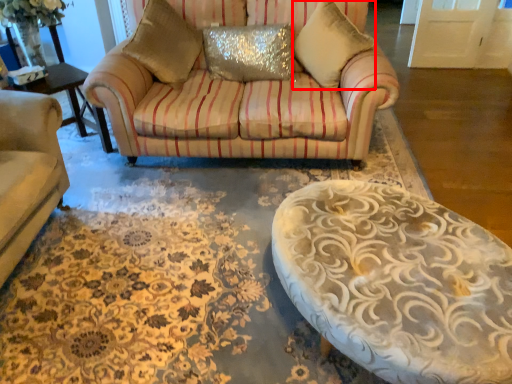
Question: From the image's perspective, considering the relative positions of pillow (annotated by the red box) and pillow in the image provided, where is pillow (annotated by the red box) located with respect to the staircase?

Choices:
 (A) above
 (B) below

Answer: (A)